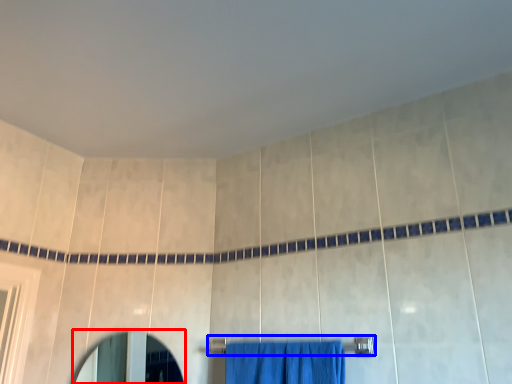
Question: Which object appears closest to the camera in this image, mirror (highlighted by a red box) or towel bar (highlighted by a blue box)?

Choices:
 (A) mirror
 (B) towel bar

Answer: (B)